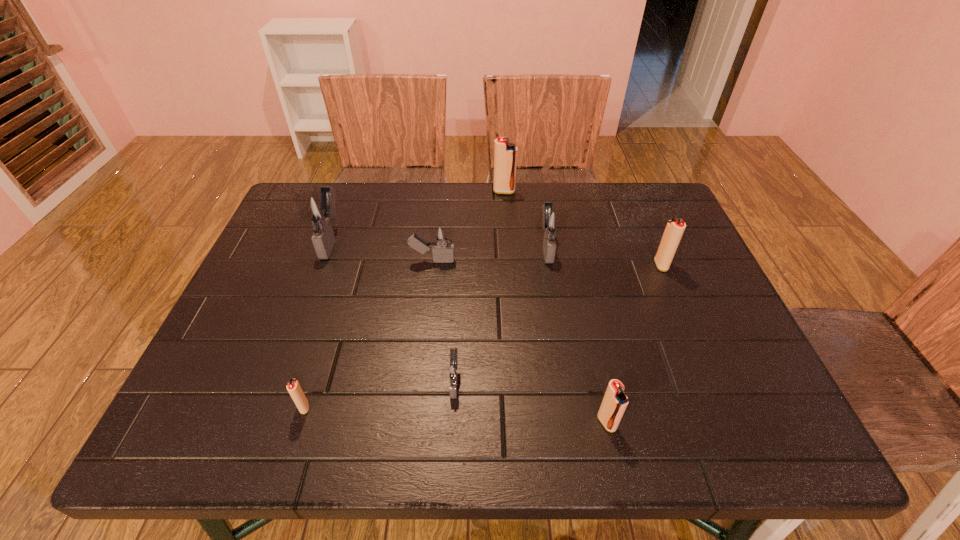
This screenshot has width=960, height=540. I want to click on the biggest red igniter, so click(x=505, y=154).

This screenshot has height=540, width=960. I want to click on the farthest igniter, so click(x=505, y=154).

The image size is (960, 540). Identify the location of the biggest gray igniter. (319, 210).

At what (x,y) coordinates should I click in order to perform the action: click on the leftmost object. Please return your answer as a coordinate pair (x, y). The width and height of the screenshot is (960, 540). Looking at the image, I should click on (319, 210).

Locate an element on the screen. The image size is (960, 540). the second biggest red igniter is located at coordinates (674, 230).

Identify the location of the rightmost object. This screenshot has height=540, width=960. (674, 230).

Where is `the third smallest gray igniter`? Image resolution: width=960 pixels, height=540 pixels. the third smallest gray igniter is located at coordinates (551, 222).

Find the location of `the sixth object from left to right`. the sixth object from left to right is located at coordinates (551, 222).

Where is `the third biggest gray igniter`? This screenshot has width=960, height=540. the third biggest gray igniter is located at coordinates (443, 252).

At what (x,y) coordinates should I click in order to perform the action: click on the third red igniter from left to right. Please return your answer as a coordinate pair (x, y). This screenshot has width=960, height=540. Looking at the image, I should click on pyautogui.click(x=613, y=406).